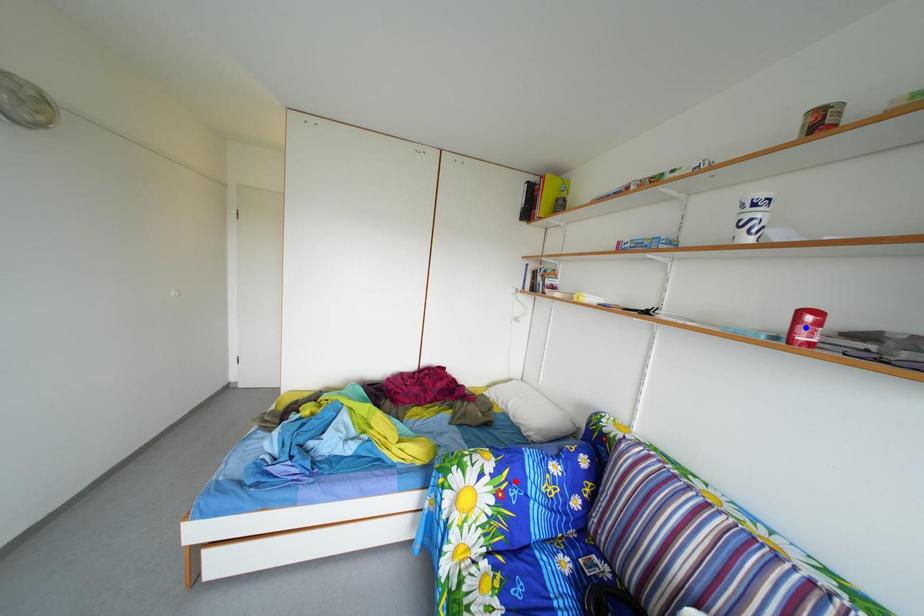
Question: In the image, two points are highlighted. Which point is nearer to the camera? Reply with the corresponding letter.

Choices:
 (A) blue point
 (B) red point

Answer: (A)